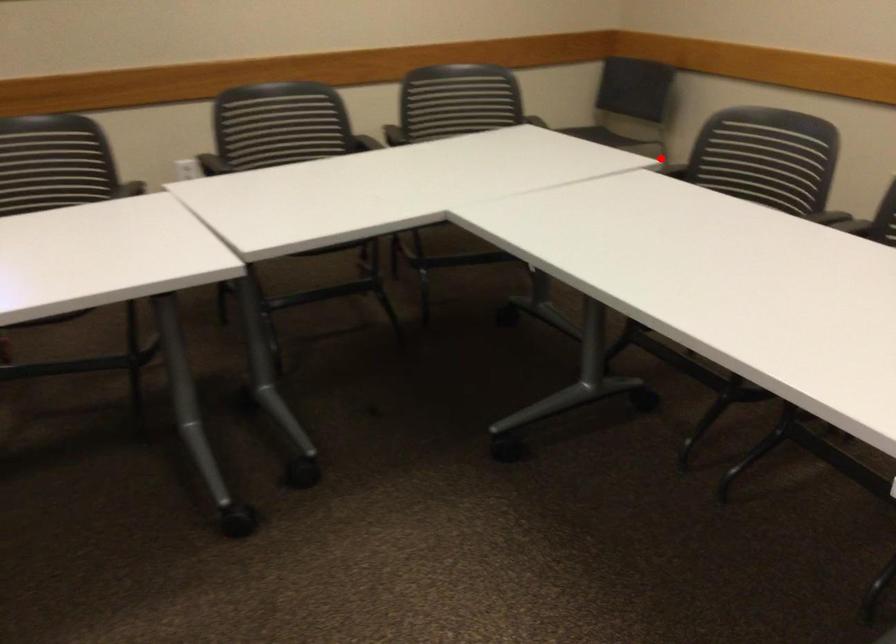
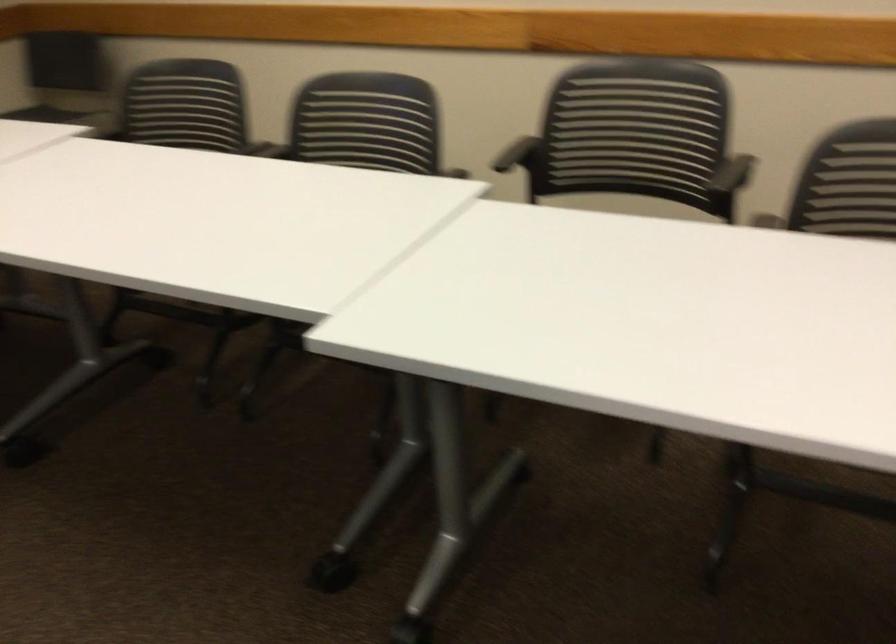
Question: I am providing you with two images of the same scene from different viewpoints. A red point is marked on the first image. Can you still see the location of the red point in image 2?

Choices:
 (A) Yes
 (B) No

Answer: (B)